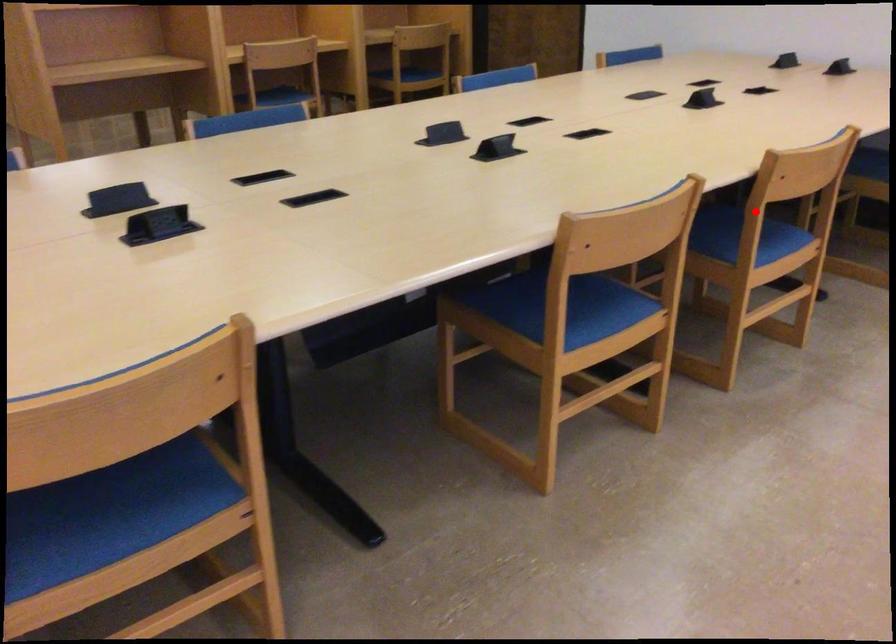
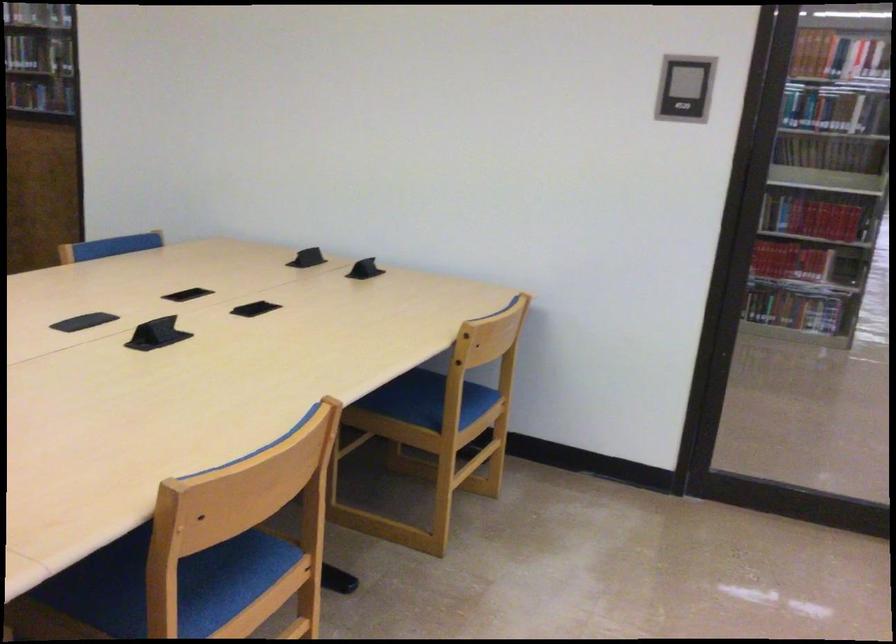
In the second image, find the point that corresponds to the highlighted location in the first image.

(174, 585)